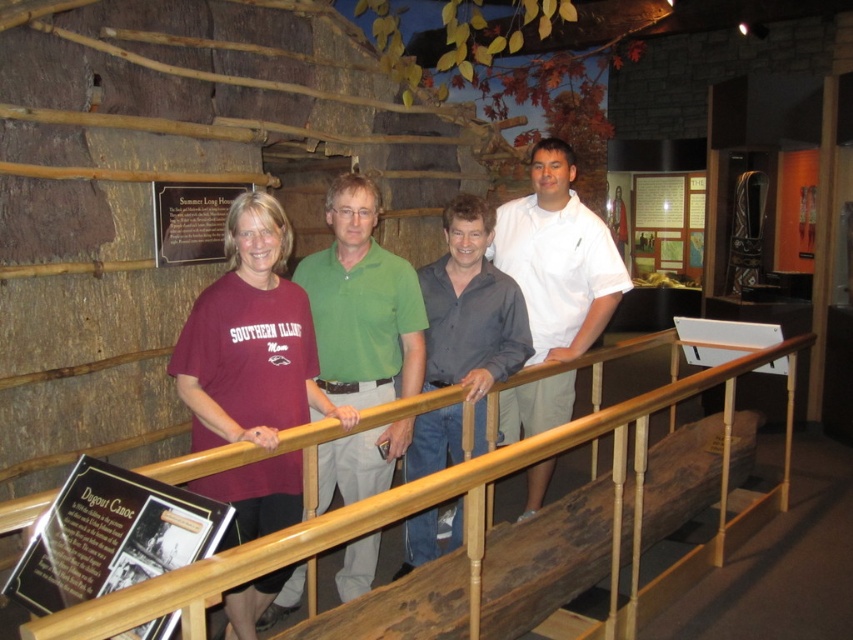
You are standing at the point marked as point (505, 262) in the museum. If you want to reach the exit located 4 meters behind you, can you walk straight back without any obstacles?

The distance of point (505, 262) from viewer is 3.31 meters, so walking straight back 4 meters would take you beyond the current position, but since the exit is behind, you need to ensure there are no obstacles in that path. However, the description does not mention any obstacles behind, so it might be possible.

You are a security guard in the museum and need to ensure that all visitors are standing behind the wooden railing. You notice two visitors wearing a white cotton polo shirt at center and a dark gray shirt at center. Which visitor is standing closer to the railing?

The white cotton polo shirt at center has a greater height compared to dark gray shirt at center, so the taller visitor in the white cotton polo shirt at center is standing closer to the railing.